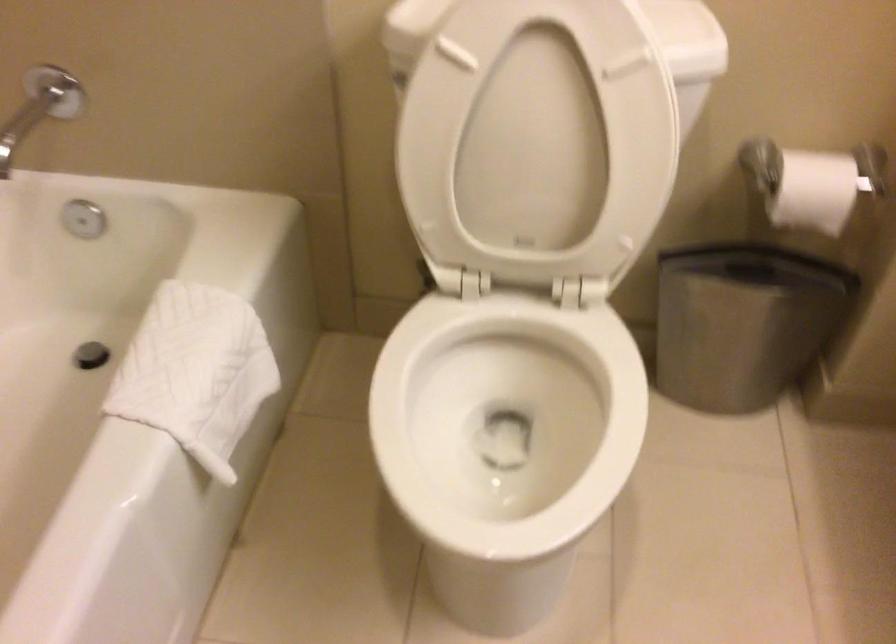
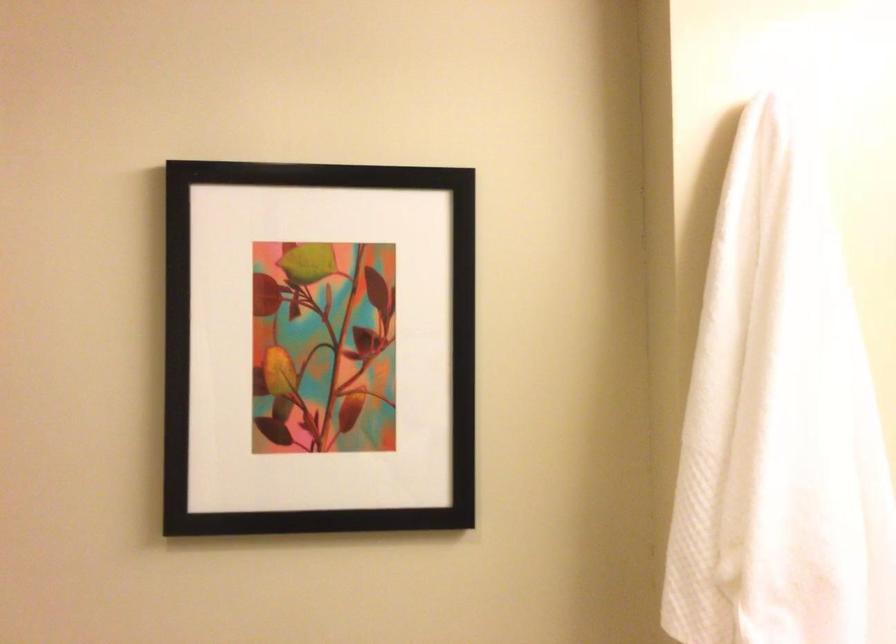
Based on the photo, the images are taken continuously from a first-person perspective. In which direction is your viewpoint rotating?

The rotation direction of the camera is right-up.